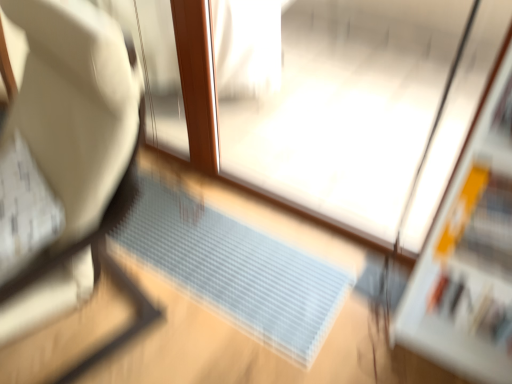
Measure the distance between translucent plastic doormat at center and camera.

translucent plastic doormat at center is 4.55 feet away from camera.

Describe the element at coordinates (77, 140) in the screenshot. I see `white fabric chair at left` at that location.

The image size is (512, 384). Describe the element at coordinates (366, 110) in the screenshot. I see `transparent plastic screen door at center` at that location.

At what (x,y) coordinates should I click in order to perform the action: click on translucent plastic doormat at center. Please return your answer as a coordinate pair (x, y). The height and width of the screenshot is (384, 512). Looking at the image, I should click on (234, 269).

Is transparent plastic screen door at center inside translucent plastic doormat at center?

That's incorrect, transparent plastic screen door at center is not inside translucent plastic doormat at center.

Which is closer, (x=204, y=258) or (x=497, y=7)?

The point (x=497, y=7) is in front.

Does translucent plastic doormat at center have a smaller size compared to transparent plastic screen door at center?

Correct, translucent plastic doormat at center occupies less space than transparent plastic screen door at center.

From the image's perspective, is translucent plastic doormat at center beneath transparent plastic screen door at center?

Yes, from the image's perspective, translucent plastic doormat at center is below transparent plastic screen door at center.

Considering the relative sizes of transparent plastic screen door at center and translucent plastic doormat at center in the image provided, is transparent plastic screen door at center bigger than translucent plastic doormat at center?

Indeed, transparent plastic screen door at center has a larger size compared to translucent plastic doormat at center.

Is transparent plastic screen door at center outside of translucent plastic doormat at center?

transparent plastic screen door at center is positioned outside translucent plastic doormat at center.

From a real-world perspective, is transparent plastic screen door at center located higher than translucent plastic doormat at center?

Correct, in the physical world, transparent plastic screen door at center is higher than translucent plastic doormat at center.

Based on the photo, is white fabric chair at left wider than translucent plastic doormat at center?

Indeed, white fabric chair at left has a greater width compared to translucent plastic doormat at center.

Is white fabric chair at left in contact with translucent plastic doormat at center?

They are not placed beside each other.

In terms of size, does white fabric chair at left appear bigger or smaller than translucent plastic doormat at center?

Considering their sizes, white fabric chair at left takes up more space than translucent plastic doormat at center.

Is translucent plastic doormat at center next to white fabric chair at left and touching it?

No, translucent plastic doormat at center is not touching white fabric chair at left.

Between translucent plastic doormat at center and white fabric chair at left, which one appears on the right side from the viewer's perspective?

translucent plastic doormat at center.

From a real-world perspective, is translucent plastic doormat at center located higher than white fabric chair at left?

No.

This screenshot has width=512, height=384. I want to click on furniture on the left side of transparent plastic screen door at center, so click(77, 140).

Which object is wider, transparent plastic screen door at center or white fabric chair at left?

white fabric chair at left.

Considering the relative sizes of transparent plastic screen door at center and white fabric chair at left in the image provided, is transparent plastic screen door at center bigger than white fabric chair at left?

No.

Does transparent plastic screen door at center have a greater height compared to white fabric chair at left?

In fact, transparent plastic screen door at center may be shorter than white fabric chair at left.

From the image's perspective, between white fabric chair at left and transparent plastic screen door at center, which one is located above?

transparent plastic screen door at center is shown above in the image.

Would you say white fabric chair at left is to the left or to the right of transparent plastic screen door at center in the picture?

Based on their positions, white fabric chair at left is located to the left of transparent plastic screen door at center.

Is white fabric chair at left oriented towards transparent plastic screen door at center?

No, white fabric chair at left does not turn towards transparent plastic screen door at center.

I want to click on screen door that appears in front of the translucent plastic doormat at center, so click(x=366, y=110).

Where is `screen door located above the translucent plastic doormat at center (from a real-world perspective)`? screen door located above the translucent plastic doormat at center (from a real-world perspective) is located at coordinates (366, 110).

Considering their positions, is white fabric chair at left positioned closer to translucent plastic doormat at center than transparent plastic screen door at center?

transparent plastic screen door at center is positioned closer to the anchor translucent plastic doormat at center.

Which object lies further to the anchor point transparent plastic screen door at center, translucent plastic doormat at center or white fabric chair at left?

Among the two, white fabric chair at left is located further to transparent plastic screen door at center.

Which object lies nearer to the anchor point translucent plastic doormat at center, transparent plastic screen door at center or white fabric chair at left?

The object closer to translucent plastic doormat at center is transparent plastic screen door at center.

Considering their positions, is translucent plastic doormat at center positioned closer to white fabric chair at left than transparent plastic screen door at center?

Based on the image, translucent plastic doormat at center appears to be nearer to white fabric chair at left.

When comparing their distances from white fabric chair at left, does transparent plastic screen door at center or translucent plastic doormat at center seem closer?

The object closer to white fabric chair at left is translucent plastic doormat at center.

Considering their positions, is white fabric chair at left positioned closer to transparent plastic screen door at center than translucent plastic doormat at center?

translucent plastic doormat at center is positioned closer to the anchor transparent plastic screen door at center.

Where is `screen door located between white fabric chair at left and translucent plastic doormat at center in the depth direction`? The image size is (512, 384). screen door located between white fabric chair at left and translucent plastic doormat at center in the depth direction is located at coordinates (366, 110).